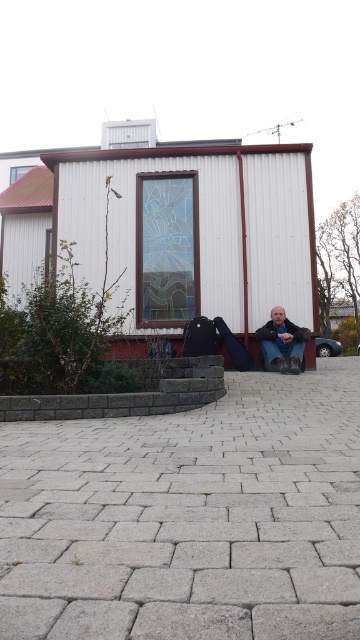
You are standing in front of the small white building with red trim and want to walk to the paved area. Which direction should you move relative to the matte black boots at lower center to reach the gray concrete pavement at center?

The gray concrete pavement at center is to the left of the matte black boots at lower center, so you should move to the left relative to the matte black boots at lower center to reach it.

You are standing at the point marked by the coordinates (189, 516) in the image. What material are you standing on?

The point at coordinates (189, 516) corresponds to gray concrete pavement at center.

You are standing in front of the small white building with red trim. You need to place a small potted plant on the gray concrete pavement at center. However, there are matte black boots at lower center in the way. Can you place the plant there without moving the boots?

The gray concrete pavement at center is closer to the viewer than the matte black boots at lower center, meaning the boots are actually behind the pavement. Therefore, you can place the plant on the pavement without moving the boots since they are not blocking the area.